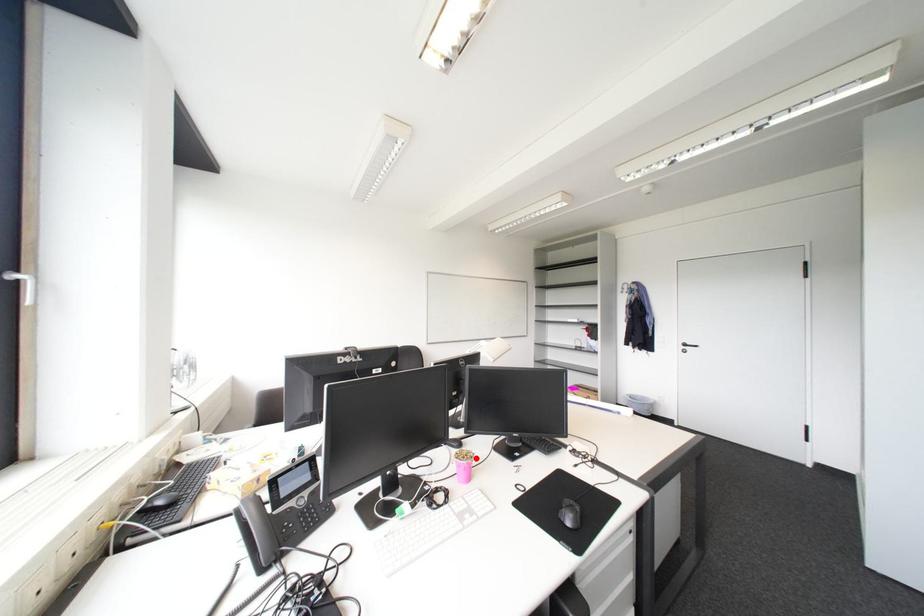
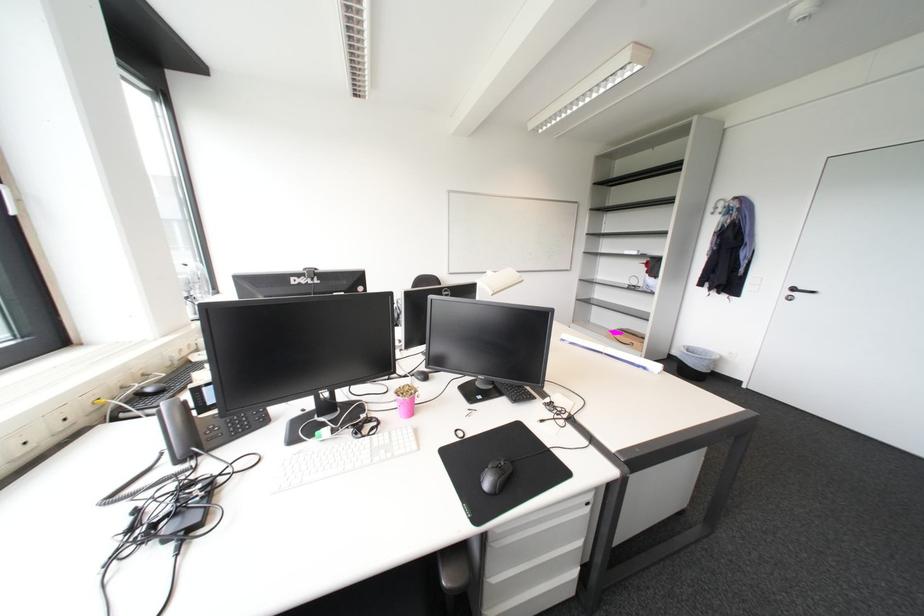
Find the pixel in the second image that matches the highlighted location in the first image.

(415, 394)